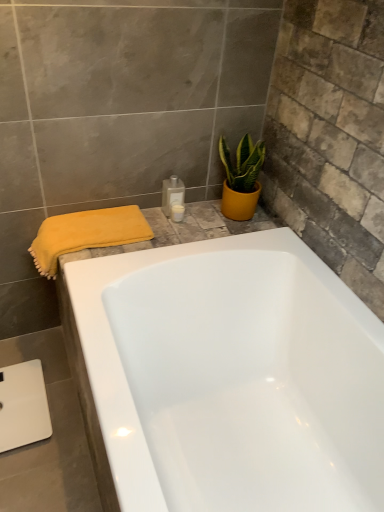
Locate an element on the screen. This screenshot has height=512, width=384. vacant space to the right of white glossy bottle at upper center, acting as the 2th toiletry starting from the top is located at coordinates (210, 223).